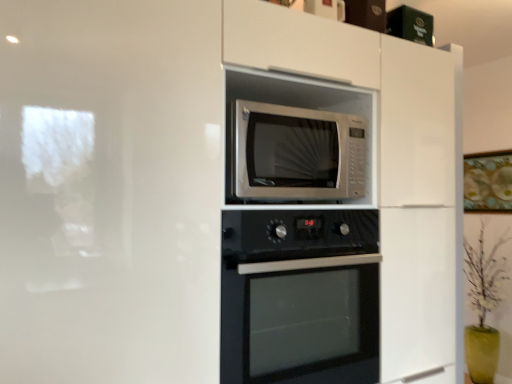
Question: Does black glass oven at center have a greater width compared to silver metallic microwave at center?

Choices:
 (A) yes
 (B) no

Answer: (A)

Question: Is black glass oven at center oriented towards silver metallic microwave at center?

Choices:
 (A) yes
 (B) no

Answer: (B)

Question: Is black glass oven at center smaller than silver metallic microwave at center?

Choices:
 (A) yes
 (B) no

Answer: (B)

Question: Is black glass oven at center turned away from silver metallic microwave at center?

Choices:
 (A) yes
 (B) no

Answer: (B)

Question: Is black glass oven at center located outside silver metallic microwave at center?

Choices:
 (A) no
 (B) yes

Answer: (B)

Question: Is point (260, 344) closer or farther from the camera than point (458, 107)?

Choices:
 (A) closer
 (B) farther

Answer: (B)

Question: From a real-world perspective, is black glass oven at center positioned above or below white glossy microwave at upper center?

Choices:
 (A) below
 (B) above

Answer: (A)

Question: Is black glass oven at center spatially inside white glossy microwave at upper center, or outside of it?

Choices:
 (A) inside
 (B) outside

Answer: (A)

Question: In the image, is black glass oven at center positioned in front of or behind white glossy microwave at upper center?

Choices:
 (A) front
 (B) behind

Answer: (B)

Question: From the image's perspective, relative to black glass oven at center, is silver metallic microwave at center above or below?

Choices:
 (A) below
 (B) above

Answer: (B)

Question: From a real-world perspective, is silver metallic microwave at center positioned above or below black glass oven at center?

Choices:
 (A) below
 (B) above

Answer: (B)

Question: Does point (238, 137) appear closer or farther from the camera than point (287, 230)?

Choices:
 (A) closer
 (B) farther

Answer: (B)

Question: Based on their sizes in the image, would you say silver metallic microwave at center is bigger or smaller than black glass oven at center?

Choices:
 (A) small
 (B) big

Answer: (A)

Question: Visually, is white glossy microwave at upper center positioned to the left or to the right of silver metallic microwave at center?

Choices:
 (A) left
 (B) right

Answer: (A)

Question: From a real-world perspective, is white glossy microwave at upper center positioned above or below silver metallic microwave at center?

Choices:
 (A) below
 (B) above

Answer: (A)